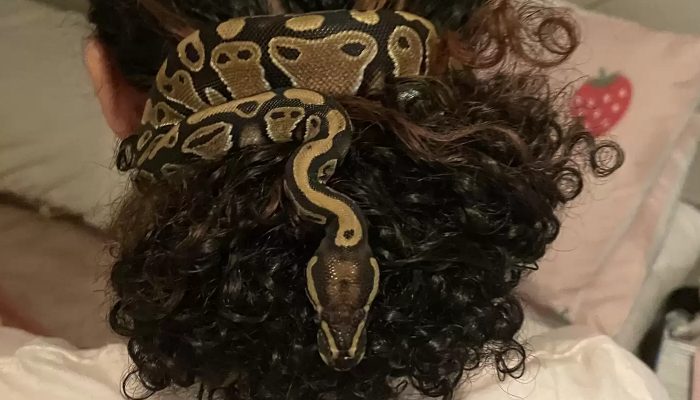
Locate an element on the screen. This screenshot has width=700, height=400. pillow is located at coordinates (68, 152), (648, 144).